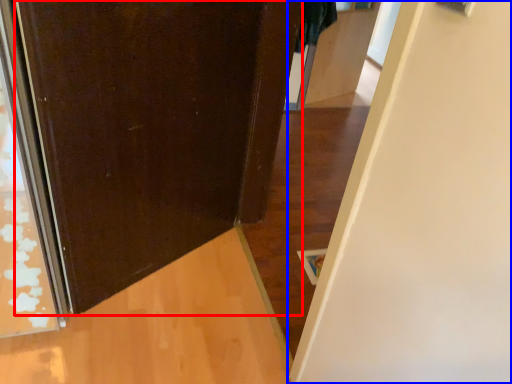
Question: Which point is closer to the camera, door (highlighted by a red box) or door (highlighted by a blue box)?

Choices:
 (A) door
 (B) door

Answer: (B)